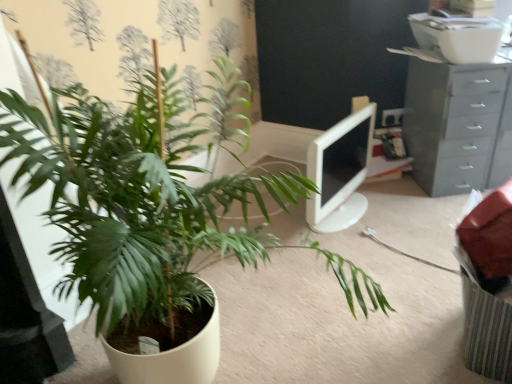
Question: Is white glossy monitor at center facing towards gray plastic chest of drawers at upper right?

Choices:
 (A) no
 (B) yes

Answer: (A)

Question: From the image's perspective, is white glossy monitor at center under gray plastic chest of drawers at upper right?

Choices:
 (A) yes
 (B) no

Answer: (A)

Question: Can you confirm if white glossy monitor at center is bigger than gray plastic chest of drawers at upper right?

Choices:
 (A) yes
 (B) no

Answer: (B)

Question: Can you confirm if white glossy monitor at center is thinner than gray plastic chest of drawers at upper right?

Choices:
 (A) yes
 (B) no

Answer: (A)

Question: Does white glossy monitor at center come behind gray plastic chest of drawers at upper right?

Choices:
 (A) no
 (B) yes

Answer: (A)

Question: Are white glossy monitor at center and gray plastic chest of drawers at upper right beside each other?

Choices:
 (A) no
 (B) yes

Answer: (A)

Question: Is green matte plant at center-left to the left of gray plastic chest of drawers at upper right from the viewer's perspective?

Choices:
 (A) no
 (B) yes

Answer: (B)

Question: Is green matte plant at center-left looking in the opposite direction of gray plastic chest of drawers at upper right?

Choices:
 (A) no
 (B) yes

Answer: (A)

Question: Considering the relative sizes of green matte plant at center-left and gray plastic chest of drawers at upper right in the image provided, is green matte plant at center-left taller than gray plastic chest of drawers at upper right?

Choices:
 (A) no
 (B) yes

Answer: (B)

Question: Is green matte plant at center-left not within gray plastic chest of drawers at upper right?

Choices:
 (A) yes
 (B) no

Answer: (A)

Question: Does green matte plant at center-left come in front of gray plastic chest of drawers at upper right?

Choices:
 (A) no
 (B) yes

Answer: (B)

Question: Is there a large distance between green matte plant at center-left and gray plastic chest of drawers at upper right?

Choices:
 (A) yes
 (B) no

Answer: (A)

Question: Is white glossy monitor at center at the back of green matte plant at center-left?

Choices:
 (A) no
 (B) yes

Answer: (A)